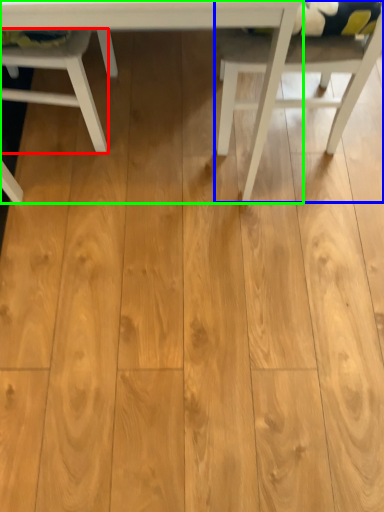
Question: Which object is positioned farthest from chair (highlighted by a red box)? Select from chair (highlighted by a blue box) and table (highlighted by a green box).

Choices:
 (A) chair
 (B) table

Answer: (A)